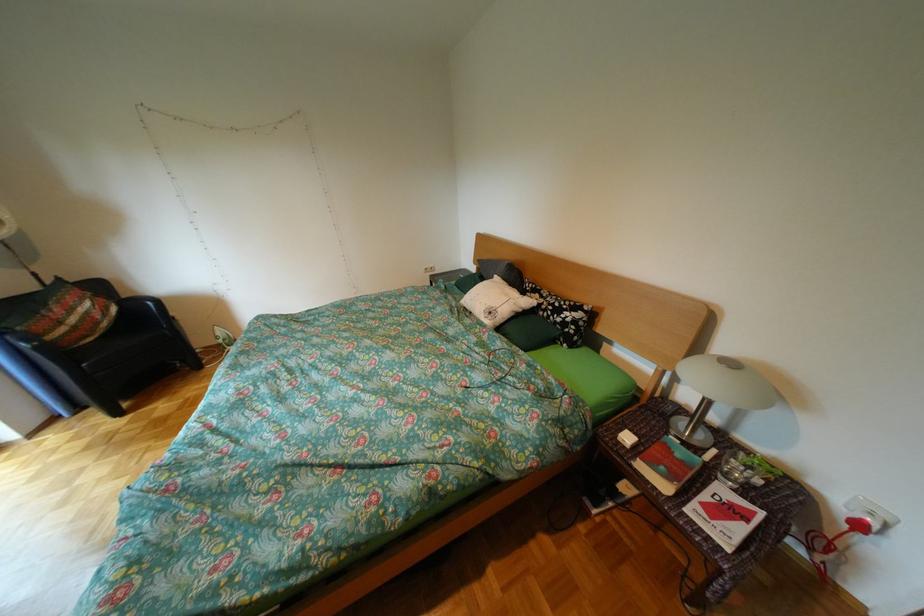
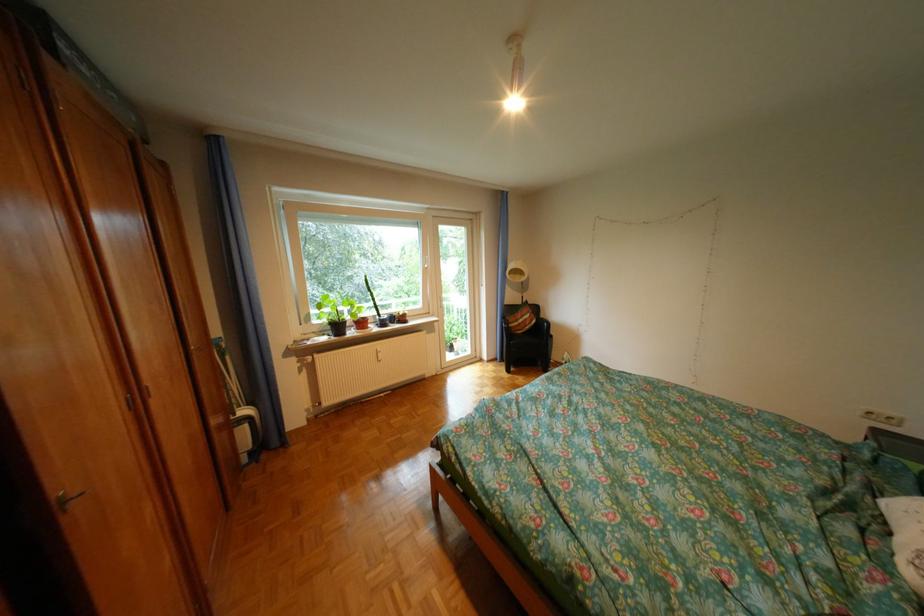
Question: The camera is either moving clockwise (left) or counter-clockwise (right) around the object. The first image is from the beginning of the video and the second image is from the end. Is the camera moving left or right when shooting the video?

Choices:
 (A) Left
 (B) Right

Answer: (B)